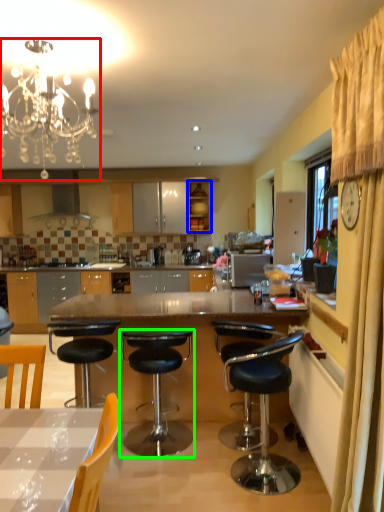
Question: Based on their relative distances, which object is nearer to light fixture (highlighted by a red box)? Choose from cabinetry (highlighted by a blue box) and chair (highlighted by a green box).

Choices:
 (A) cabinetry
 (B) chair

Answer: (B)